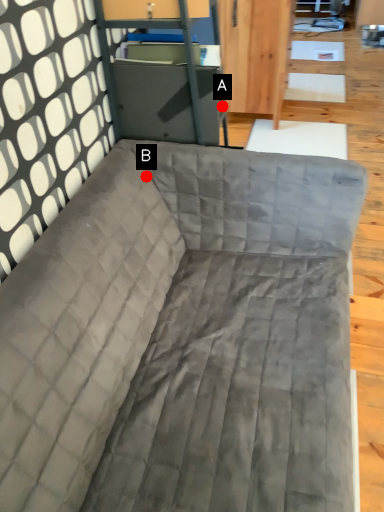
Question: Two points are circled on the image, labeled by A and B beside each circle. Which point appears closest to the camera in this image?

Choices:
 (A) A is closer
 (B) B is closer

Answer: (A)